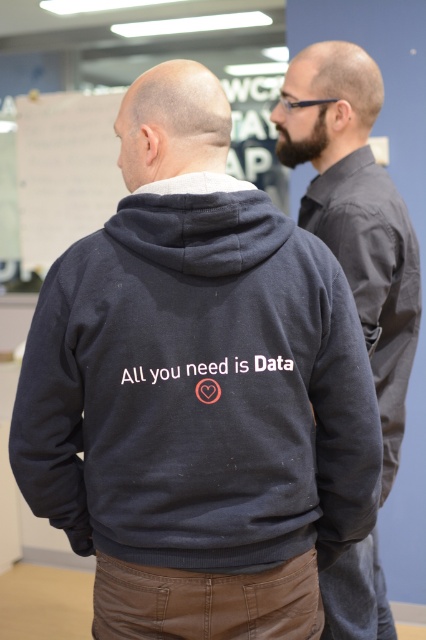
You are a fashion designer observing two hoodies in an office setting. The dark blue hoodie at center and the dark gray hoodie at center are both in view. Which one appears shorter in height?

The dark blue hoodie at center has a lesser height compared to the dark gray hoodie at center, so the dark blue hoodie at center appears shorter.

You are standing at point (348,109) and want to walk to point (39,413). Are you able to walk directly to that point without moving around any obstacles?

Point (39,413) is in front of point (348,109), so yes, you can walk directly to that point without moving around any obstacles.